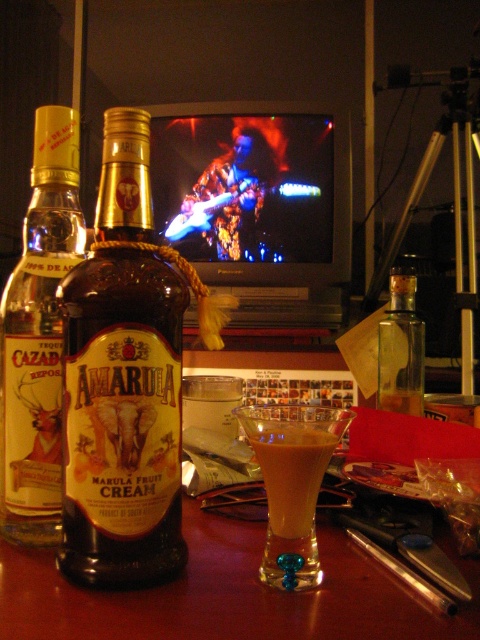
You are holding a small toy that needs to be placed exactly at point (295, 452) in the image. If the toy is 2 inches in diameter, will it fit without overlapping any objects near that point?

The distance between the viewer and point (295, 452) is 15.17 inches. Since the toy is only 2 inches in diameter, there should be enough space to place it at that point without overlapping nearby objects, assuming no obstructions at that specific location.

You are a bartender who needs to prepare a drink using the golden creamy cocktail at center and the brown creamy liquid at center. Which one should you use first if you want to layer them properly?

The golden creamy cocktail at center should be used first as it is in front of the brown creamy liquid at center, indicating it is closer to the viewer and likely the base layer in the glass.